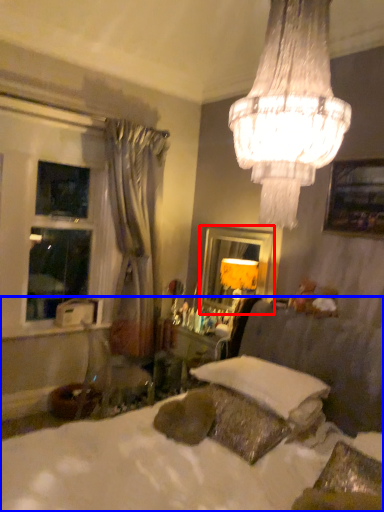
Question: Which point is closer to the camera, mirror (highlighted by a red box) or bed (highlighted by a blue box)?

Choices:
 (A) mirror
 (B) bed

Answer: (B)